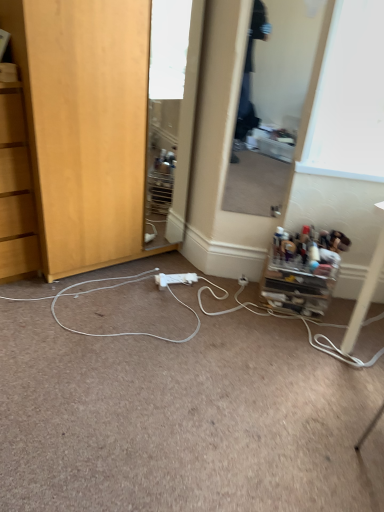
You are a GUI agent. You are given a task and a screenshot of the screen. Output one action in this format:
    pyautogui.click(x=<x>, y=<y>)
    Task: Click on the white plastic power strip at center
    This screenshot has height=512, width=384.
    Given the screenshot: What is the action you would take?
    pyautogui.click(x=183, y=418)

In the scene shown: Measure the distance between point (277, 247) and camera.

2.21 meters.

Identify the location of white plastic power outlet at center. (175, 279).

Find the location of `white plastic power strip at center`. white plastic power strip at center is located at coordinates (183, 418).

How different are the orientations of clear plastic organizer at lower right, the 1th cabinetry when ordered from right to left, and white plastic power outlet at center in degrees?

The angle between the facing direction of clear plastic organizer at lower right, the 1th cabinetry when ordered from right to left, and the facing direction of white plastic power outlet at center is 19.9 degrees.

From a real-world perspective, is clear plastic organizer at lower right, marked as the first cabinetry in a bottom-to-top arrangement, positioned under white plastic power outlet at center based on gravity?

Actually, clear plastic organizer at lower right, marked as the first cabinetry in a bottom-to-top arrangement, is physically above white plastic power outlet at center in the real world.

Image resolution: width=384 pixels, height=512 pixels. I want to click on cabinetry that is on the right side of white plastic power outlet at center, so click(299, 281).

Are clear plastic organizer at lower right, the 2th cabinetry from the top, and white plastic power outlet at center making contact?

No.

In the scene shown: From a real-world perspective, is white plastic electric outlet at center under clear glass mirror at center, arranged as the 1th mirror when viewed from the right?

Correct, in the physical world, white plastic electric outlet at center is lower than clear glass mirror at center, arranged as the 1th mirror when viewed from the right.

Which of these two, white plastic electric outlet at center or clear glass mirror at center, which is the 2th mirror from left to right, stands taller?

clear glass mirror at center, which is the 2th mirror from left to right.

Is white plastic electric outlet at center turned away from clear glass mirror at center, arranged as the 1th mirror when viewed from the right?

Answer: No, white plastic electric outlet at center's orientation is not away from clear glass mirror at center, arranged as the 1th mirror when viewed from the right.

Considering the positions of point (306, 304) and point (88, 477), is point (306, 304) closer or farther from the camera than point (88, 477)?

Point (306, 304).

Based on the photo, is white plastic power strip at center surrounded by clear plastic organizer at lower right, the 1th cabinetry when ordered from right to left?

No, clear plastic organizer at lower right, the 1th cabinetry when ordered from right to left, does not contain white plastic power strip at center.

Considering the sizes of objects clear plastic organizer at lower right, the 2th cabinetry from the top, and white plastic power strip at center in the image provided, who is taller, clear plastic organizer at lower right, the 2th cabinetry from the top, or white plastic power strip at center?

With more height is clear plastic organizer at lower right, the 2th cabinetry from the top.

Which of these two, wooden cabinet at lower left, the 1th cabinetry in the left-to-right sequence, or clear glass mirror at center, arranged as the 1th mirror when viewed from the right, is wider?

With larger width is wooden cabinet at lower left, the 1th cabinetry in the left-to-right sequence.

From the image's perspective, does wooden cabinet at lower left, which appears as the first cabinetry when viewed from the top, appear higher than clear glass mirror at center, which is the 2th mirror from left to right?

Actually, wooden cabinet at lower left, which appears as the first cabinetry when viewed from the top, appears below clear glass mirror at center, which is the 2th mirror from left to right, in the image.

Does wooden cabinet at lower left, arranged as the second cabinetry when ordered from the bottom, have a larger size compared to clear glass mirror at center, which is the 2th mirror from left to right?

Yes, wooden cabinet at lower left, arranged as the second cabinetry when ordered from the bottom, is bigger than clear glass mirror at center, which is the 2th mirror from left to right.

Could you tell me if wooden cabinet at lower left, which appears as the first cabinetry when viewed from the top, is facing clear glass mirror at center, arranged as the 1th mirror when viewed from the right?

No, wooden cabinet at lower left, which appears as the first cabinetry when viewed from the top, is not aimed at clear glass mirror at center, arranged as the 1th mirror when viewed from the right.

Is clear glass mirror at center, arranged as the 1th mirror when viewed from the right, not within clear glass mirror at center, positioned as the 1th mirror in left-to-right order?

Absolutely, clear glass mirror at center, arranged as the 1th mirror when viewed from the right, is external to clear glass mirror at center, positioned as the 1th mirror in left-to-right order.

From a real-world perspective, who is located lower, clear glass mirror at center, which is the 2th mirror from left to right, or clear glass mirror at center, which is counted as the 2th mirror, starting from the right?

clear glass mirror at center, which is counted as the 2th mirror, starting from the right, is physically lower.

Is point (284, 189) closer to camera compared to point (176, 90)?

Yes.

From the image's perspective, does clear glass mirror at center, arranged as the 1th mirror when viewed from the right, appear lower than clear glass mirror at center, positioned as the 1th mirror in left-to-right order?

No, from the image's perspective, clear glass mirror at center, arranged as the 1th mirror when viewed from the right, is not beneath clear glass mirror at center, positioned as the 1th mirror in left-to-right order.

Do you think clear plastic organizer at lower right, marked as the first cabinetry in a bottom-to-top arrangement, is within white plastic electric outlet at center, or outside of it?

clear plastic organizer at lower right, marked as the first cabinetry in a bottom-to-top arrangement, lies outside white plastic electric outlet at center.

Between clear plastic organizer at lower right, marked as the first cabinetry in a bottom-to-top arrangement, and white plastic electric outlet at center, which one has larger size?

Bigger between the two is clear plastic organizer at lower right, marked as the first cabinetry in a bottom-to-top arrangement.

Is clear plastic organizer at lower right, marked as the first cabinetry in a bottom-to-top arrangement, looking in the opposite direction of white plastic electric outlet at center?

No, white plastic electric outlet at center is not at the back of clear plastic organizer at lower right, marked as the first cabinetry in a bottom-to-top arrangement.

The height and width of the screenshot is (512, 384). What are the coordinates of `cabinetry that is the 2nd one when counting backward from the white plastic power strip at center` in the screenshot? It's located at (299, 281).

Is white plastic power strip at center surrounding clear plastic organizer at lower right, which is the second cabinetry in left-to-right order?

No, clear plastic organizer at lower right, which is the second cabinetry in left-to-right order, is located outside of white plastic power strip at center.

Considering the sizes of objects white plastic power strip at center and clear plastic organizer at lower right, which is the second cabinetry in left-to-right order, in the image provided, who is taller, white plastic power strip at center or clear plastic organizer at lower right, which is the second cabinetry in left-to-right order,?

Standing taller between the two is clear plastic organizer at lower right, which is the second cabinetry in left-to-right order.

From the picture: Does white plastic power strip at center appear on the right side of clear plastic organizer at lower right, the 2th cabinetry from the top?

In fact, white plastic power strip at center is to the left of clear plastic organizer at lower right, the 2th cabinetry from the top.

At what (x,y) coordinates should I click in order to perform the action: click on the 1st cabinetry above the white plastic power outlet at center (from a real-world perspective). Please return your answer as a coordinate pair (x, y). Looking at the image, I should click on (299, 281).

Locate an element on the screen. The width and height of the screenshot is (384, 512). electric outlet behind the clear glass mirror at center, arranged as the 1th mirror when viewed from the right is located at coordinates (243, 281).

Which object lies nearer to the anchor point wooden cabinet at lower left, arranged as the second cabinetry when ordered from the bottom, white plastic power strip at center or white plastic electric outlet at center?

Answer: white plastic power strip at center is closer to wooden cabinet at lower left, arranged as the second cabinetry when ordered from the bottom.

Estimate the real-world distances between objects in this image. Which object is further from clear glass mirror at center, which is the 2th mirror from left to right, clear glass mirror at center, which is counted as the 2th mirror, starting from the right, or wooden cabinet at lower left, placed as the 2th cabinetry when sorted from right to left?

Among the two, wooden cabinet at lower left, placed as the 2th cabinetry when sorted from right to left, is located further to clear glass mirror at center, which is the 2th mirror from left to right.

When comparing their distances from clear plastic organizer at lower right, which is the second cabinetry in left-to-right order, does white plastic power outlet at center or clear glass mirror at center, which is the 2th mirror from left to right, seem closer?

white plastic power outlet at center is positioned closer to the anchor clear plastic organizer at lower right, which is the second cabinetry in left-to-right order.

Consider the image. From the image, which object appears to be nearer to clear glass mirror at center, arranged as the 1th mirror when viewed from the right, white plastic electric outlet at center or clear plastic organizer at lower right, which is the second cabinetry in left-to-right order?

Based on the image, clear plastic organizer at lower right, which is the second cabinetry in left-to-right order, appears to be nearer to clear glass mirror at center, arranged as the 1th mirror when viewed from the right.

Estimate the real-world distances between objects in this image. Which object is further from clear glass mirror at center, which is counted as the 2th mirror, starting from the right, wooden cabinet at lower left, which appears as the first cabinetry when viewed from the top, or clear plastic organizer at lower right, the 1th cabinetry when ordered from right to left?

clear plastic organizer at lower right, the 1th cabinetry when ordered from right to left, lies further to clear glass mirror at center, which is counted as the 2th mirror, starting from the right, than the other object.

Based on their spatial positions, is white plastic power outlet at center or clear plastic organizer at lower right, marked as the first cabinetry in a bottom-to-top arrangement, further from white plastic electric outlet at center?

clear plastic organizer at lower right, marked as the first cabinetry in a bottom-to-top arrangement, lies further to white plastic electric outlet at center than the other object.

When comparing their distances from white plastic electric outlet at center, does clear glass mirror at center, positioned as the 1th mirror in left-to-right order, or white plastic power outlet at center seem further?

The object further to white plastic electric outlet at center is clear glass mirror at center, positioned as the 1th mirror in left-to-right order.

Based on their spatial positions, is white plastic power outlet at center or clear glass mirror at center, arranged as the 1th mirror when viewed from the right, further from clear glass mirror at center, positioned as the 1th mirror in left-to-right order?

white plastic power outlet at center is further to clear glass mirror at center, positioned as the 1th mirror in left-to-right order.

This screenshot has width=384, height=512. I want to click on power outlet between clear glass mirror at center, arranged as the 1th mirror when viewed from the right, and clear plastic organizer at lower right, marked as the first cabinetry in a bottom-to-top arrangement, from top to bottom, so click(175, 279).

The height and width of the screenshot is (512, 384). I want to click on electric outlet between white plastic power outlet at center and clear plastic organizer at lower right, the 2th cabinetry from the top, from left to right, so click(x=243, y=281).

The height and width of the screenshot is (512, 384). What are the coordinates of `mirror that lies between clear glass mirror at center, which is the 2th mirror from left to right, and white plastic electric outlet at center from top to bottom` in the screenshot? It's located at (164, 111).

Where is `power outlet located between white plastic power strip at center and white plastic electric outlet at center in the depth direction`? Image resolution: width=384 pixels, height=512 pixels. power outlet located between white plastic power strip at center and white plastic electric outlet at center in the depth direction is located at coordinates pyautogui.click(x=175, y=279).